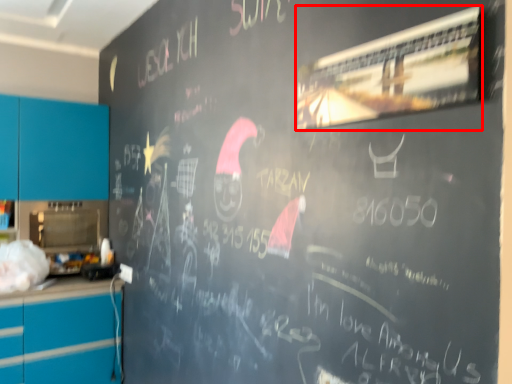
Question: From the image's perspective, where is bulletin board (annotated by the red box) located in relation to cabinetry in the image?

Choices:
 (A) below
 (B) above

Answer: (B)